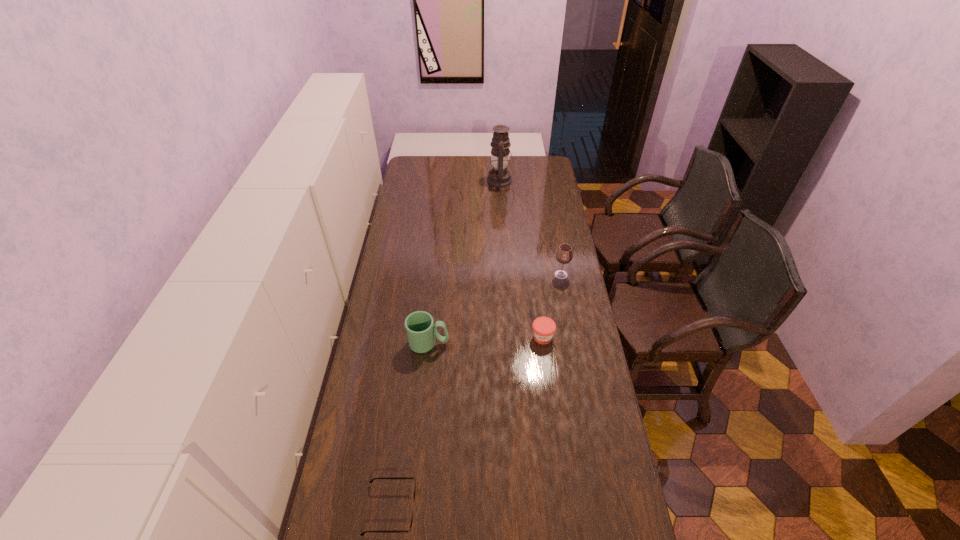
The height and width of the screenshot is (540, 960). What are the coordinates of `blank space at the left edge` in the screenshot? It's located at (423, 186).

Image resolution: width=960 pixels, height=540 pixels. In order to click on vacant space at the right edge of the desktop in this screenshot , I will do `click(553, 194)`.

You are a GUI agent. You are given a task and a screenshot of the screen. Output one action in this format:
    pyautogui.click(x=<x>, y=<y>)
    Task: Click on the vacant space at the far left corner of the desktop
    The width and height of the screenshot is (960, 540).
    Given the screenshot: What is the action you would take?
    pyautogui.click(x=409, y=176)

Where is `vacant area that lies between the fourth object from left to right and the third tallest object`? The height and width of the screenshot is (540, 960). vacant area that lies between the fourth object from left to right and the third tallest object is located at coordinates (486, 340).

Where is `empty space that is in between the farthest object and the third shortest object`? This screenshot has height=540, width=960. empty space that is in between the farthest object and the third shortest object is located at coordinates (465, 262).

What are the coordinates of `free space between the wineglass and the second shortest object` in the screenshot? It's located at (552, 306).

In order to click on free point between the farthest object and the shortest object in this screenshot , I will do `click(446, 345)`.

Find the location of a particular element. The height and width of the screenshot is (540, 960). empty space between the third object from right to left and the wineglass is located at coordinates (531, 228).

Identify the location of vacant region between the jam and the third tallest object. pyautogui.click(x=486, y=340).

Find the location of a particular element. This screenshot has height=540, width=960. blank region between the fourth shortest object and the jam is located at coordinates (552, 306).